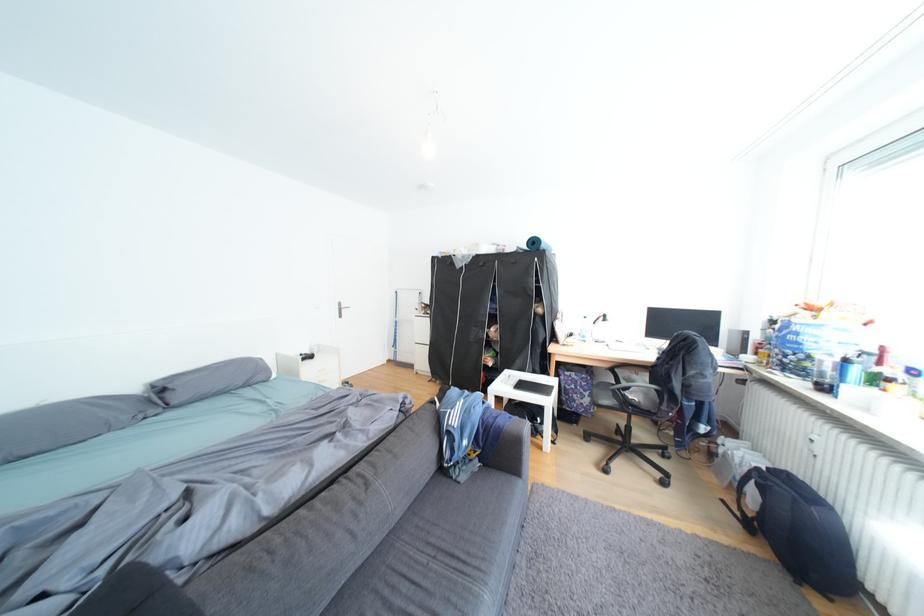
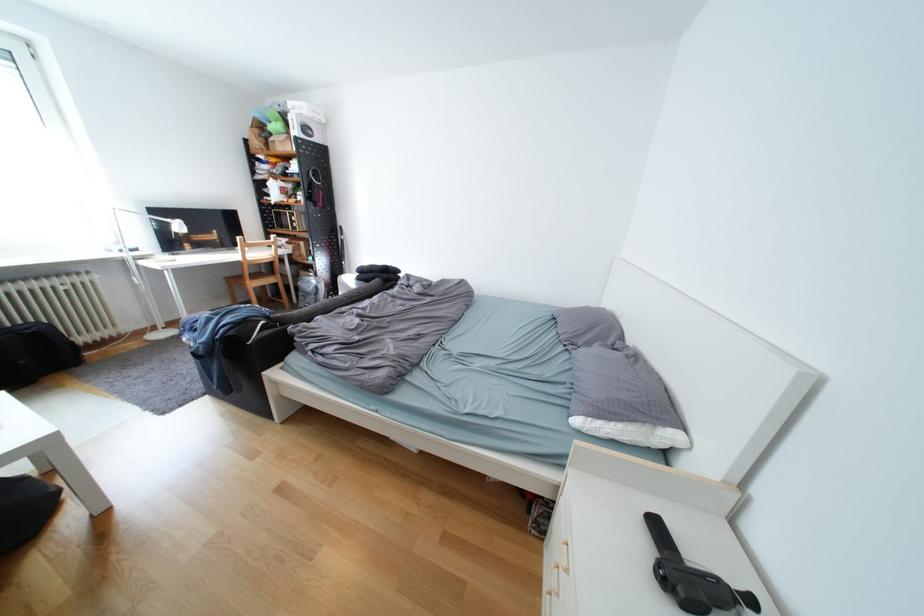
Question: I am providing you with two images of the same scene from different viewpoints. Which of the following objects are not visible in image2?

Choices:
 (A) black handheld device
 (B) push pin
 (C) grey sofa armrest
 (D) microwave door handle

Answer: (C)